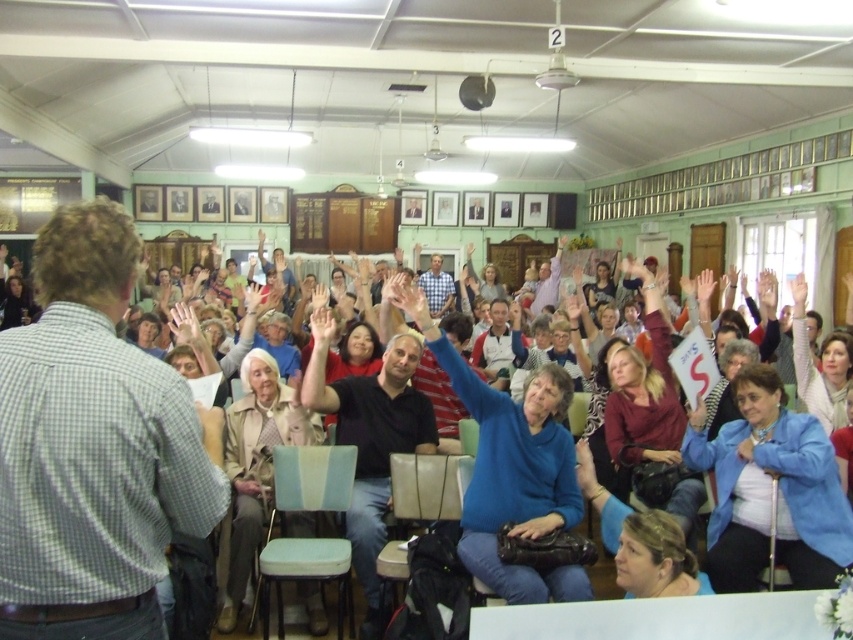
You are standing at the entrance of the hall and see the point marked at coordinates [509,467]. What object is located at that position?

The point at coordinates [509,467] corresponds to the blue matte sweater at center.

You are standing at the back of the room and want to see the speaker clearly. There are two people in front of you wearing dark blue shirt at center and blue sweater at center. Which person should you ask to move so you can see better?

You should ask the dark blue shirt at center to move because they might be wider than the blue sweater at center, blocking your view.

You are standing at the entrance of the hall and notice a person wearing a dark blue shirt at center. If you walk straight towards the front of the room, will this person be in your direct path?

The dark blue shirt at center is located at point (x=370, y=440), which is near the center of the room. Since you are walking straight towards the front, the person wearing the dark blue shirt at center would be in your direct path if their position aligns with the central axis. However, without exact coordinates of the front, it is uncertain. But given their central position, they are likely in your path.